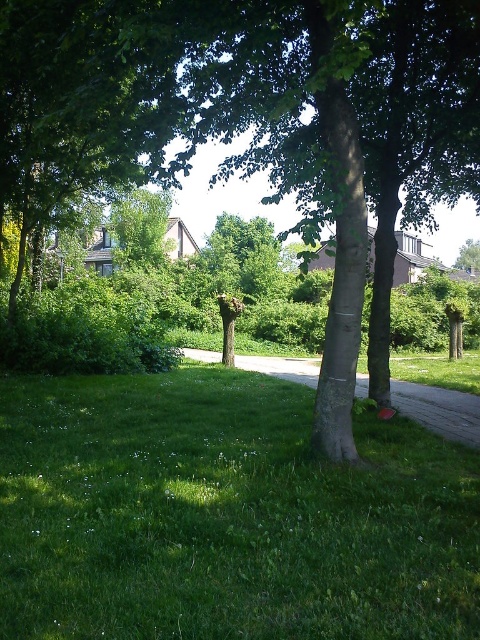
Question: Can you confirm if green grass at lower left is wider than green leafy tree at center?

Choices:
 (A) no
 (B) yes

Answer: (A)

Question: Does green grass at lower left have a smaller size compared to green leafy tree at center?

Choices:
 (A) yes
 (B) no

Answer: (A)

Question: Which point is closer to the camera?

Choices:
 (A) (196, 56)
 (B) (217, 497)

Answer: (B)

Question: Considering the relative positions of green grass at lower left and green leafy tree at center in the image provided, where is green grass at lower left located with respect to green leafy tree at center?

Choices:
 (A) right
 (B) left

Answer: (B)